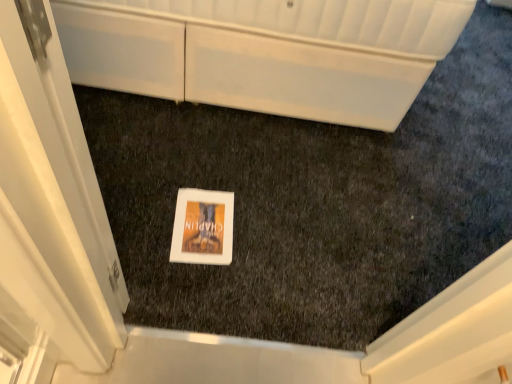
Question: Is white glossy door at center looking in the opposite direction of white glossy cabinet at upper center?

Choices:
 (A) yes
 (B) no

Answer: (B)

Question: Is the depth of white glossy door at center less than that of white glossy cabinet at upper center?

Choices:
 (A) no
 (B) yes

Answer: (B)

Question: Considering the relative sizes of white glossy door at center and white glossy cabinet at upper center in the image provided, is white glossy door at center thinner than white glossy cabinet at upper center?

Choices:
 (A) no
 (B) yes

Answer: (B)

Question: Considering the relative sizes of white glossy door at center and white glossy cabinet at upper center in the image provided, is white glossy door at center bigger than white glossy cabinet at upper center?

Choices:
 (A) no
 (B) yes

Answer: (A)

Question: Can you confirm if white glossy door at center is taller than white glossy cabinet at upper center?

Choices:
 (A) no
 (B) yes

Answer: (B)

Question: From the image's perspective, does white glossy door at center appear higher than white glossy cabinet at upper center?

Choices:
 (A) yes
 (B) no

Answer: (B)

Question: Does white glossy cabinet at upper center contain white glossy door at center?

Choices:
 (A) no
 (B) yes

Answer: (A)

Question: Is white glossy cabinet at upper center at the right side of white glossy door at center?

Choices:
 (A) no
 (B) yes

Answer: (B)

Question: Would you consider white glossy cabinet at upper center to be distant from white glossy door at center?

Choices:
 (A) yes
 (B) no

Answer: (A)

Question: From a real-world perspective, is white glossy cabinet at upper center located beneath white glossy door at center?

Choices:
 (A) no
 (B) yes

Answer: (B)

Question: From the image's perspective, is white glossy cabinet at upper center above white glossy door at center?

Choices:
 (A) no
 (B) yes

Answer: (B)

Question: Does white glossy cabinet at upper center appear on the left side of white glossy door at center?

Choices:
 (A) yes
 (B) no

Answer: (B)

Question: From a real-world perspective, is white glossy door at center above or below white glossy cabinet at upper center?

Choices:
 (A) below
 (B) above

Answer: (B)